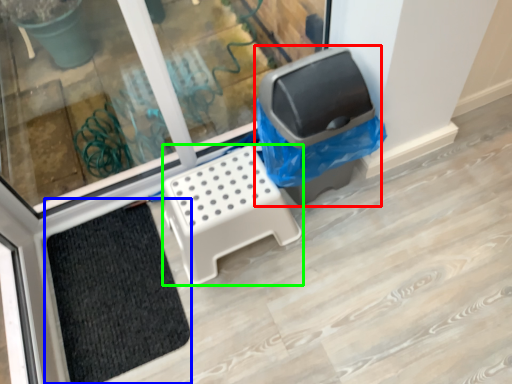
Question: Which object is positioned closest to recycling bin (highlighted by a red box)? Select from doormat (highlighted by a blue box) and furniture (highlighted by a green box).

Choices:
 (A) doormat
 (B) furniture

Answer: (B)